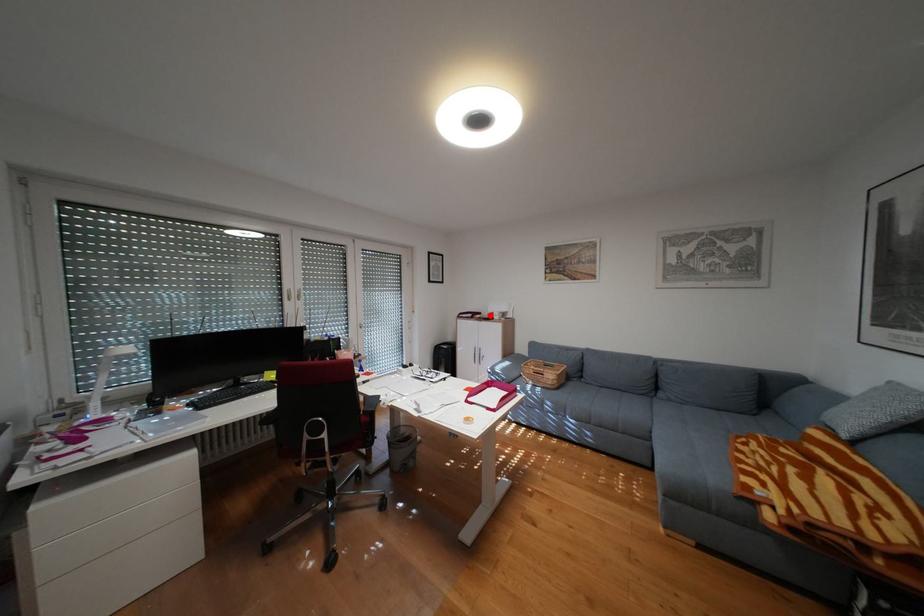
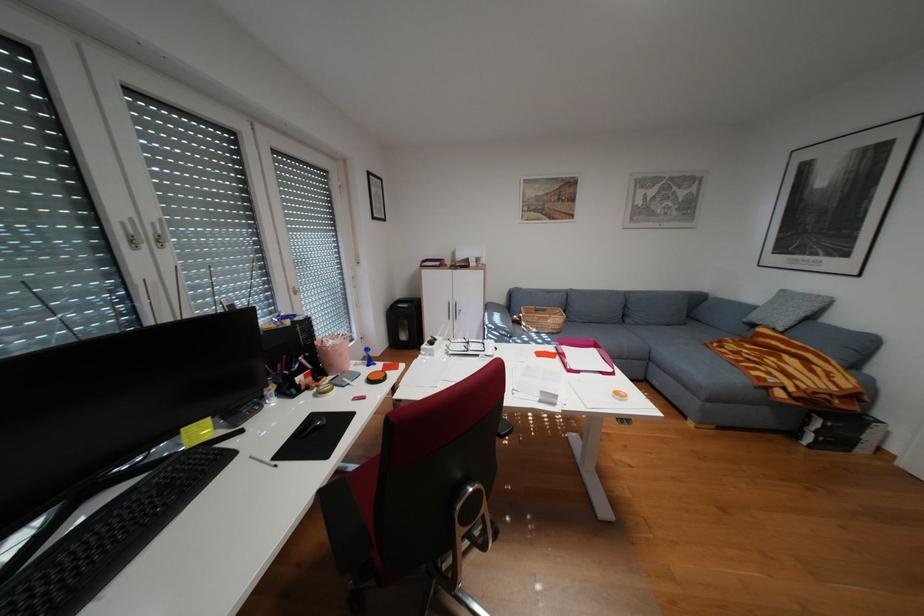
Locate, in the second image, the point that corresponds to the highlighted location in the first image.

(460, 262)